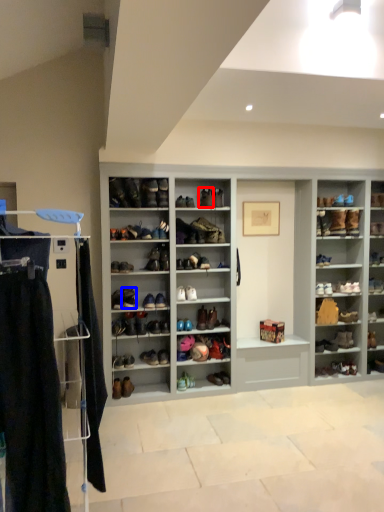
Question: Which point is further to the camera, shoe (highlighted by a red box) or footwear (highlighted by a blue box)?

Choices:
 (A) shoe
 (B) footwear

Answer: (A)